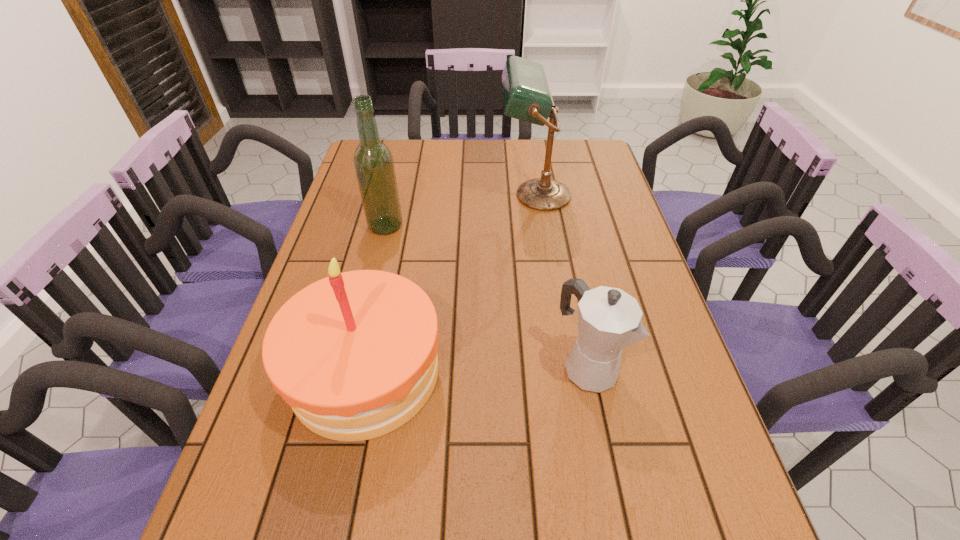
Locate an element on the screen. This screenshot has width=960, height=540. table lamp is located at coordinates (526, 96).

The width and height of the screenshot is (960, 540). I want to click on liquor, so click(x=374, y=166).

You are a GUI agent. You are given a task and a screenshot of the screen. Output one action in this format:
    pyautogui.click(x=<x>, y=<y>)
    Task: Click on the birthday cake
    This screenshot has width=960, height=540.
    Given the screenshot: What is the action you would take?
    pyautogui.click(x=354, y=354)

This screenshot has width=960, height=540. I want to click on the shortest object, so [609, 319].

The image size is (960, 540). Identify the location of vacant region located 0.290m above the green lampshade of the table lamp. (412, 195).

Identify the location of vacant region located above the green lampshade of the table lamp. This screenshot has height=540, width=960. (478, 195).

Image resolution: width=960 pixels, height=540 pixels. Identify the location of vacant area located 0.150m above the green lampshade of the table lamp. (454, 195).

You are a GUI agent. You are given a task and a screenshot of the screen. Output one action in this format:
    pyautogui.click(x=<x>, y=<y>)
    Task: Click on the vacant position located 0.230m on the right of the liquor
    This screenshot has width=960, height=540.
    Given the screenshot: What is the action you would take?
    pyautogui.click(x=478, y=226)

The width and height of the screenshot is (960, 540). In order to click on vacant area situated 0.260m on the back of the birthday cake in this screenshot , I will do `click(393, 245)`.

Locate an element on the screen. This screenshot has width=960, height=540. vacant region located 0.110m on the right of the shortest object is located at coordinates (665, 366).